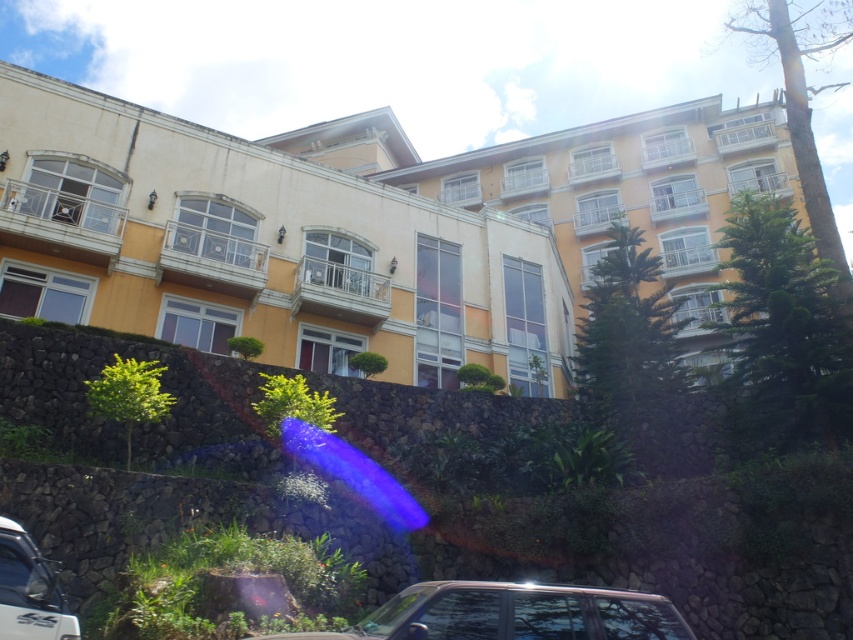
Question: Which point is farther to the camera?

Choices:
 (A) [x=6, y=605]
 (B) [x=453, y=632]

Answer: (A)

Question: Does green leafy shrubs at lower center have a lesser width compared to shiny silver car at lower center?

Choices:
 (A) no
 (B) yes

Answer: (A)

Question: Is yellow matte building at center above shiny silver car at lower center?

Choices:
 (A) no
 (B) yes

Answer: (B)

Question: Can you confirm if yellow matte building at center is positioned below white glossy car at lower left?

Choices:
 (A) no
 (B) yes

Answer: (A)

Question: Based on their relative distances, which object is nearer to the shiny silver car at lower center?

Choices:
 (A) yellow matte building at center
 (B) white glossy car at lower left

Answer: (B)

Question: Considering the real-world distances, which object is farthest from the shiny silver car at lower center?

Choices:
 (A) white glossy car at lower left
 (B) yellow matte building at center

Answer: (B)